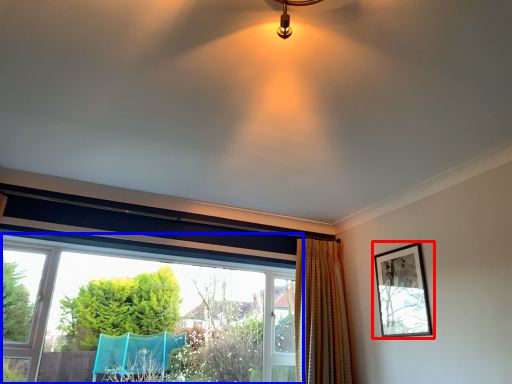
Question: Among these objects, which one is nearest to the camera, picture frame (highlighted by a red box) or window (highlighted by a blue box)?

Choices:
 (A) picture frame
 (B) window

Answer: (B)